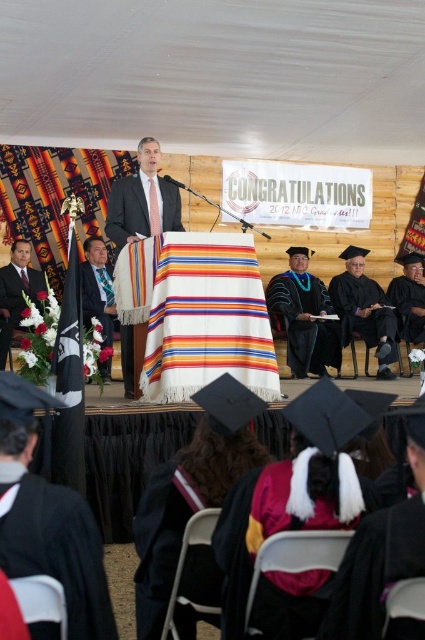
Does point (121, 224) come closer to viewer compared to point (380, 307)?

Yes, point (121, 224) is closer to viewer.

I want to click on matte black suit at center, so click(142, 200).

Can you confirm if multicolored woven blanket at center is positioned above matte black suit at left?

No.

Is multicolored woven blanket at center in front of matte black suit at left?

That is False.

What do you see at coordinates (303, 321) in the screenshot?
I see `multicolored woven blanket at center` at bounding box center [303, 321].

Find the location of a particular element. The image size is (425, 640). multicolored woven blanket at center is located at coordinates (303, 321).

Who is more forward, (292,284) or (110,378)?

Positioned in front is point (110,378).

Between multicolored woven blanket at center and matte black suit at lower left, which one is positioned higher?

matte black suit at lower left

What do you see at coordinates (303, 321) in the screenshot? This screenshot has width=425, height=640. I see `multicolored woven blanket at center` at bounding box center [303, 321].

Identify the location of multicolored woven blanket at center. The height and width of the screenshot is (640, 425). (303, 321).